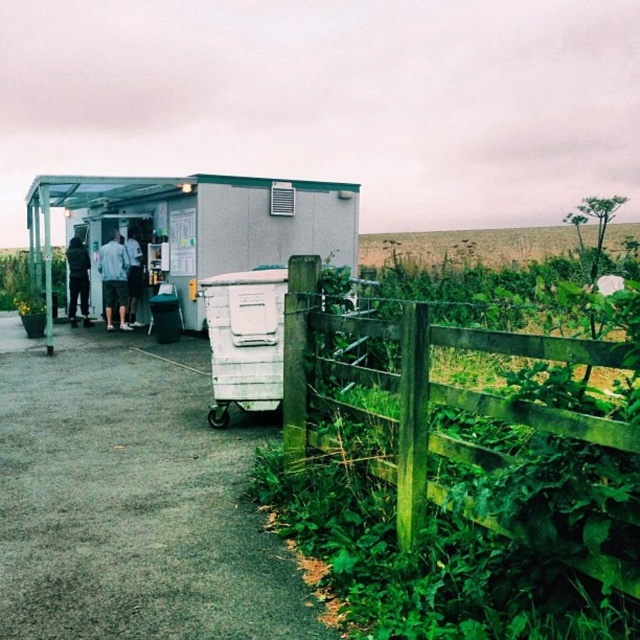
Question: Is light blue denim shorts at center above white shirt at center?

Choices:
 (A) yes
 (B) no

Answer: (A)

Question: Which object appears closest to the camera in this image?

Choices:
 (A) green wooden fence at lower right
 (B) dark gray jacket at center

Answer: (A)

Question: Among these points, which one is farthest from the camera?

Choices:
 (A) (132, 275)
 (B) (112, 278)
 (C) (301, 285)
 (D) (220, 404)

Answer: (A)

Question: Considering the real-world distances, which object is closest to the dark gray jacket at center?

Choices:
 (A) light blue denim shorts at center
 (B) white plastic trailer at lower right
 (C) green wooden fence at lower right

Answer: (A)

Question: Does light blue denim shorts at center lie behind dark gray jacket at center?

Choices:
 (A) no
 (B) yes

Answer: (A)

Question: Considering the relative positions of white plastic trailer at lower right and dark gray jacket at center in the image provided, where is white plastic trailer at lower right located with respect to dark gray jacket at center?

Choices:
 (A) right
 (B) left

Answer: (A)